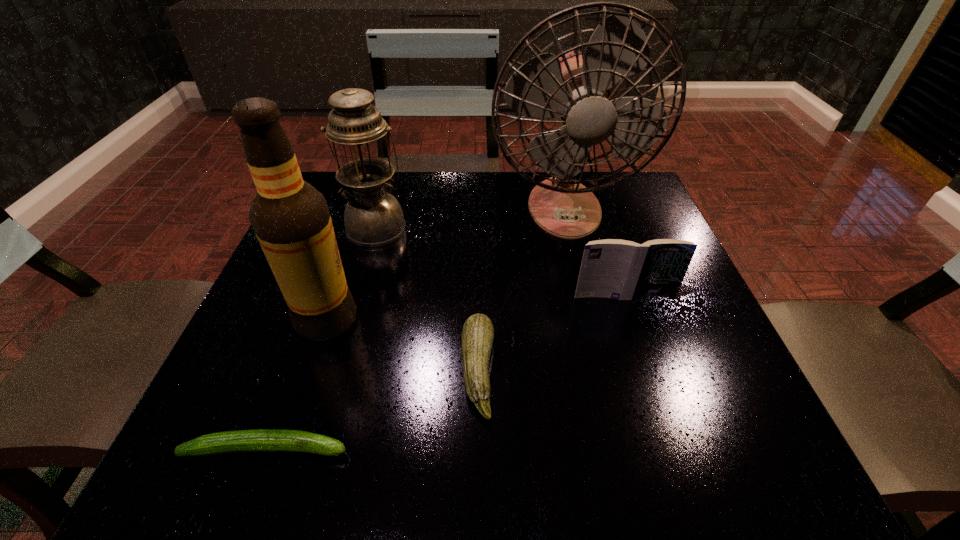
Find the location of a particular element. Image resolution: width=960 pixels, height=540 pixels. book located in the right edge section of the desktop is located at coordinates (612, 268).

Where is `object positioned at the far left corner`? object positioned at the far left corner is located at coordinates (373, 217).

Where is `object that is positioned at the near left corner`? The image size is (960, 540). object that is positioned at the near left corner is located at coordinates (260, 440).

Where is `object that is at the far right corner`? object that is at the far right corner is located at coordinates (577, 89).

Where is `free space at the far edge of the desktop`? This screenshot has width=960, height=540. free space at the far edge of the desktop is located at coordinates point(405,174).

In order to click on vacant region at the near edge in this screenshot , I will do `click(526, 452)`.

In order to click on free space at the left edge of the desktop in this screenshot , I will do `click(252, 362)`.

Identify the location of vacant space at the right edge of the desktop. (684, 318).

Locate an element on the screen. The width and height of the screenshot is (960, 540). vacant space at the near right corner is located at coordinates (740, 449).

Locate an element on the screen. free space between the alcohol and the third tallest object is located at coordinates click(351, 274).